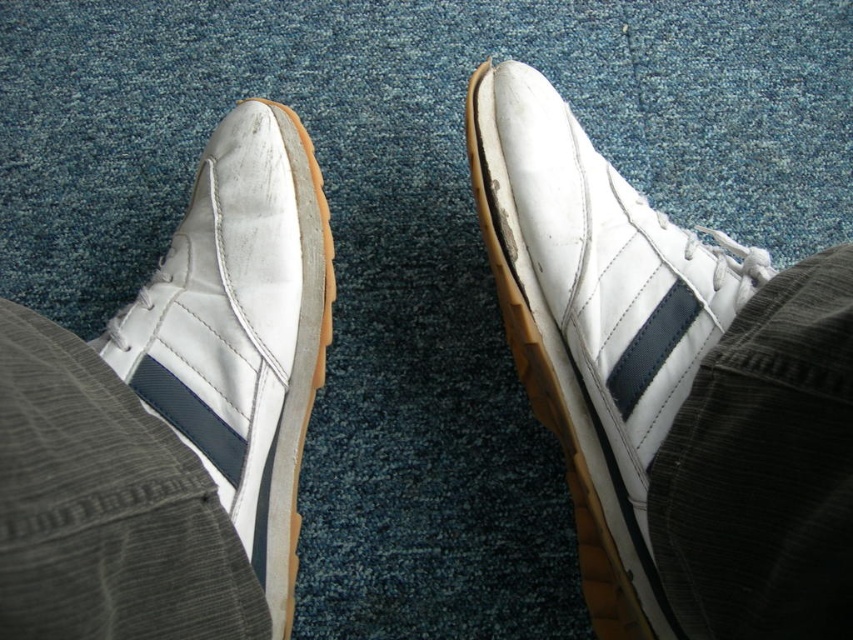
You are standing in a room with a textured blue carpet. You notice a point on the carpet at coordinate point (596, 232). If you want to place a 24 inch long object horizontally on the carpet so that one end is exactly at that point, where would the other end be?

The distance between point (596, 232) and the viewer is 33.80 inches. Since the object is 24 inches long and placed horizontally, the other end would be 24 inches away from the point in the direction you choose, but the exact coordinate depends on the direction chosen. However, the question does not specify the direction, so the answer cannot be determined with the given information.

You are a shoe designer observing the image. You need to determine which shoe is taller between the white leather shoe at upper center and the white leather shoe at left. Which one is taller?

The white leather shoe at upper center is taller than the white leather shoe at left according to the description.

Based on the photo, you are a photographer trying to capture the white leather shoe at upper center and the white leather shoe at left in a single shot. Which shoe should you focus on first if you want to ensure both are in focus, given their positions?

The white leather shoe at upper center is above the white leather shoe at left, so focusing on the upper one first would help ensure both are in focus as they are aligned vertically.